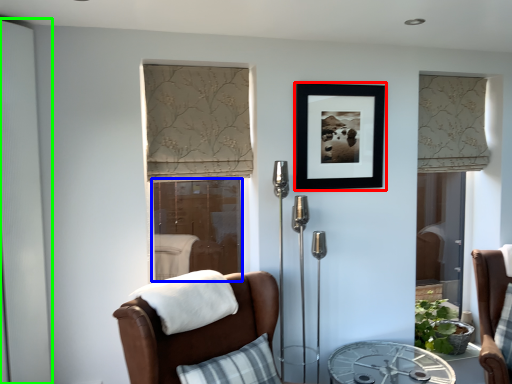
Question: Which is farther away from picture frame (highlighted by a red box)? screen door (highlighted by a blue box) or screen door (highlighted by a green box)?

Choices:
 (A) screen door
 (B) screen door

Answer: (A)